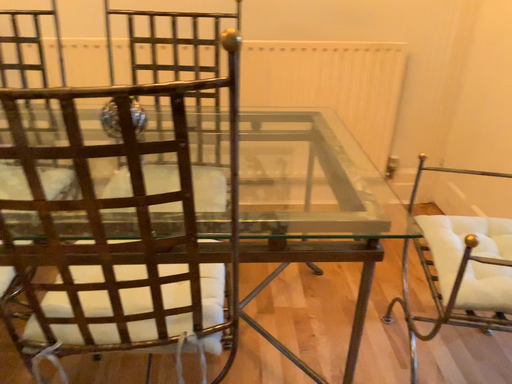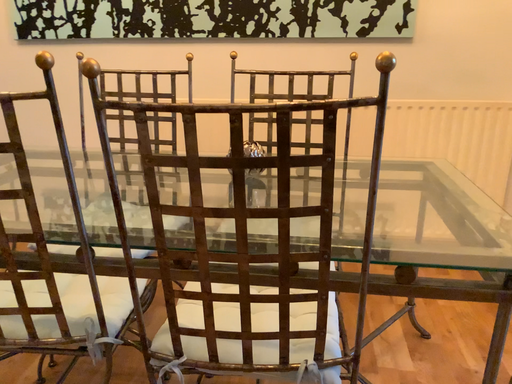
Question: How did the camera likely rotate when shooting the video?

Choices:
 (A) rotated left
 (B) rotated right

Answer: (A)